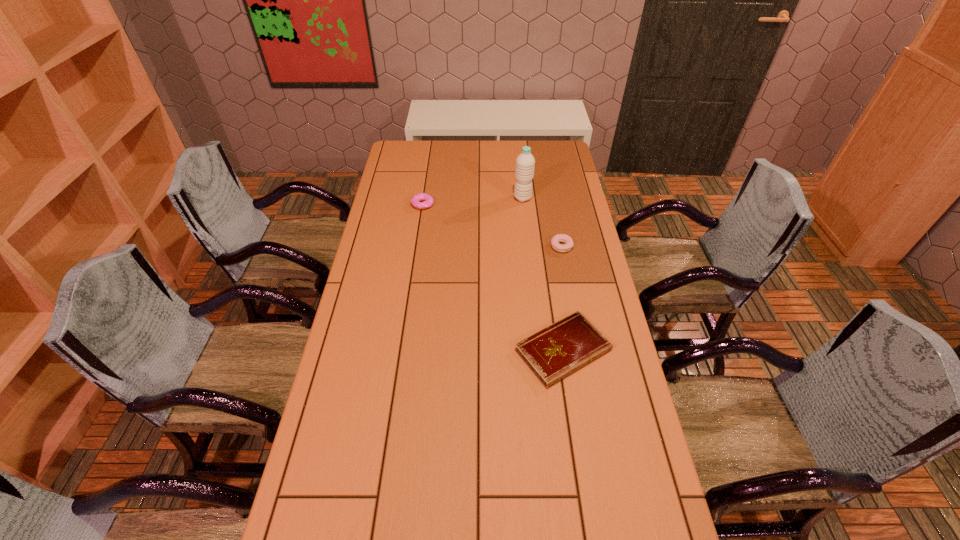
Identify the location of free space in the image that satisfies the following two spatial constraints: 1. on the back side of the tallest object; 2. on the left side of the left doughnut. (423, 198).

In order to click on vacant space that satisfies the following two spatial constraints: 1. on the front side of the farther doughnut; 2. on the left side of the right doughnut in this screenshot , I will do `click(417, 246)`.

Where is `vacant space that satisfies the following two spatial constraints: 1. on the front side of the water bottle; 2. on the left side of the right doughnut`? The image size is (960, 540). vacant space that satisfies the following two spatial constraints: 1. on the front side of the water bottle; 2. on the left side of the right doughnut is located at coordinates (528, 246).

At what (x,y) coordinates should I click in order to perform the action: click on vacant region that satisfies the following two spatial constraints: 1. on the back side of the water bottle; 2. on the left side of the farther doughnut. Please return your answer as a coordinate pair (x, y). This screenshot has height=540, width=960. Looking at the image, I should click on (423, 198).